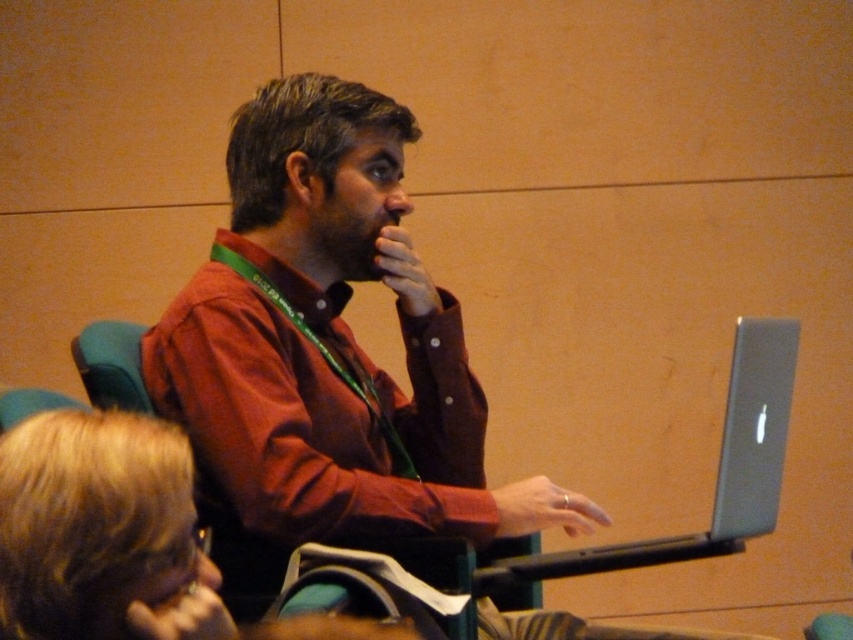
You are a photographer trying to capture a candid shot of the man using his silver metallic laptop at right. However, there is a blonde hair at upper left blocking your view. From the current angle, which object is closer to the camera?

The blonde hair at upper left is closer to the camera because it is positioned to the left of the silver metallic laptop at right.

You are a photographer trying to capture a clear shot of both the matte red shirt at center and the blonde hair at upper left. Which object is closer to the camera?

The matte red shirt at center is closer to the camera than the blonde hair at upper left because it is further to the viewer.